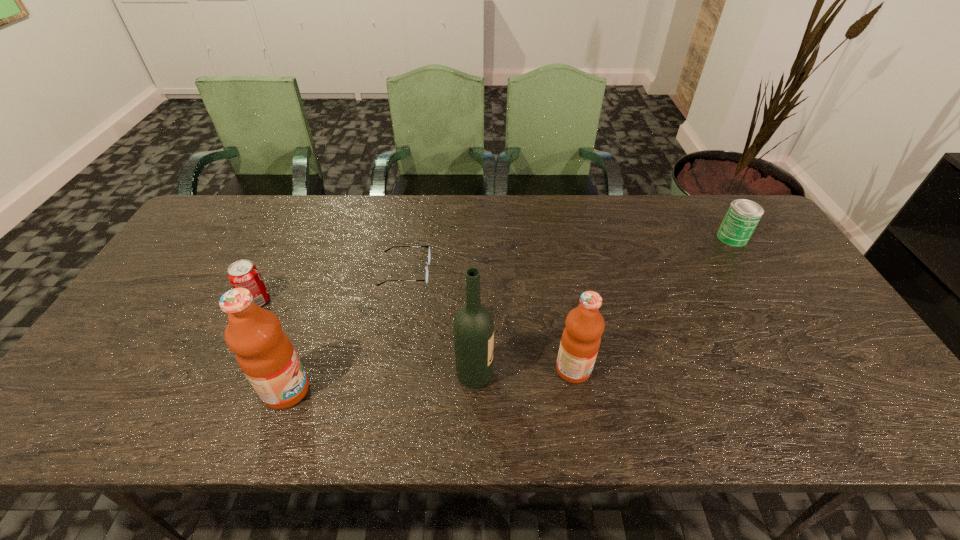
Identify the location of the third object from right to left. The image size is (960, 540). (473, 328).

What are the coordinates of `vacant space situated on the front label of the left fruit juice` in the screenshot? It's located at (379, 390).

In order to click on vacant space located on the front label of the fifth object from left to right in this screenshot , I will do pos(731,369).

At what (x,y) coordinates should I click in order to perform the action: click on vacant space located 0.260m on the left of the farthest object. Please return your answer as a coordinate pair (x, y). Looking at the image, I should click on (636, 237).

The width and height of the screenshot is (960, 540). Find the location of `vacant position located on the right of the leftmost object`. vacant position located on the right of the leftmost object is located at coordinates (388, 301).

Locate an element on the screen. vacant space located on the lenses of the spectacles is located at coordinates (533, 271).

Find the location of a particular element. Image resolution: width=960 pixels, height=540 pixels. free point located on the labeled side of the third object from right to left is located at coordinates (608, 375).

The height and width of the screenshot is (540, 960). Identify the location of object at the far edge. (742, 216).

The width and height of the screenshot is (960, 540). What are the coordinates of `wine bottle that is at the near edge` in the screenshot? It's located at (473, 328).

The width and height of the screenshot is (960, 540). What are the coordinates of `object present at the right edge` in the screenshot? It's located at (742, 216).